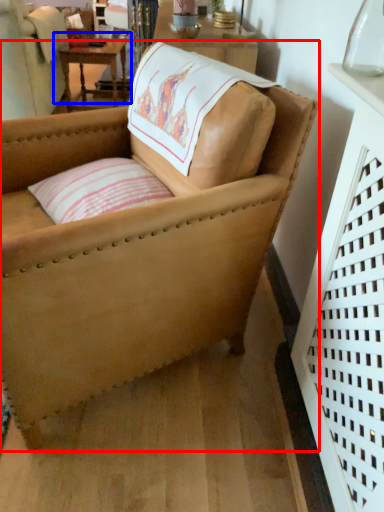
Question: Among these objects, which one is farthest to the camera, chair (highlighted by a red box) or table (highlighted by a blue box)?

Choices:
 (A) chair
 (B) table

Answer: (B)